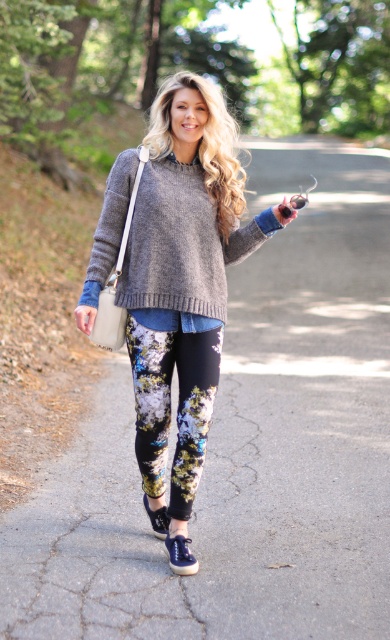
Question: Is knit sweater at center bigger than knit gray sweater at center?

Choices:
 (A) no
 (B) yes

Answer: (B)

Question: Does knit sweater at center appear under floral printed leggings at center?

Choices:
 (A) yes
 (B) no

Answer: (B)

Question: Which is farther from the knit sweater at center?

Choices:
 (A) knit gray sweater at center
 (B) floral printed leggings at center

Answer: (B)

Question: Is knit gray sweater at center wider than floral printed leggings at center?

Choices:
 (A) yes
 (B) no

Answer: (A)

Question: Which point is farther to the camera?

Choices:
 (A) (131, 269)
 (B) (104, 211)
 (C) (177, 490)

Answer: (B)

Question: Considering the real-world distances, which object is farthest from the floral printed leggings at center?

Choices:
 (A) knit sweater at center
 (B) knit gray sweater at center

Answer: (B)